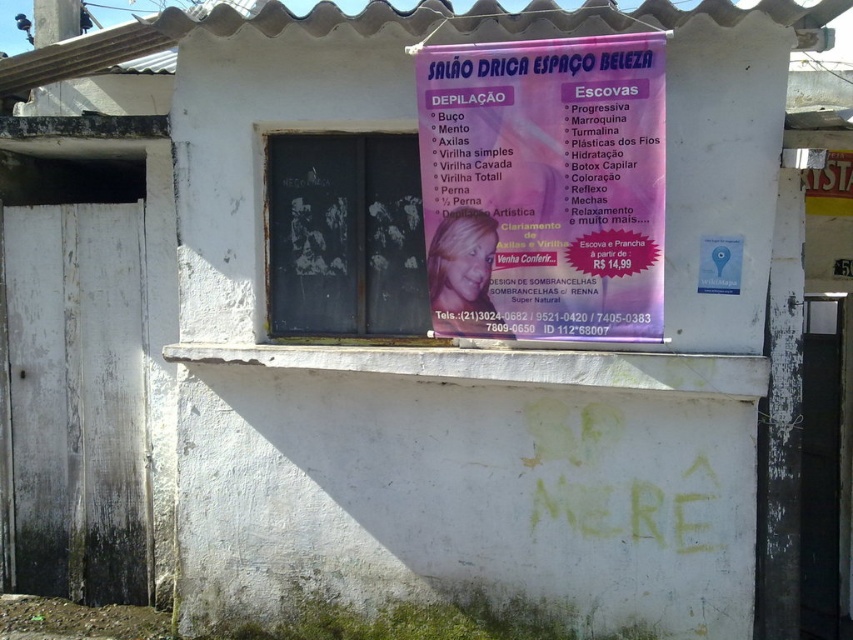
You are standing in front of the building and notice two points on the banner. The first point is at coordinates point (502, 198) and the second is at point (318, 202). Which point is closer to you?

The point at coordinates point (502, 198) is closer to you than the point at point (318, 202).

What is the relationship in size between the pink paper poster at upper center and the black chalkboard at center?

The pink paper poster at upper center is bigger than the black chalkboard at center.